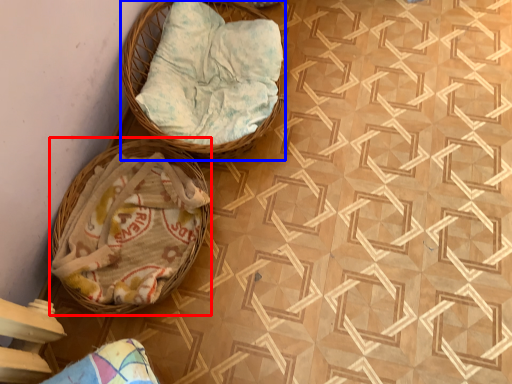
Question: Which object is further to the camera taking this photo, basket (highlighted by a red box) or basket (highlighted by a blue box)?

Choices:
 (A) basket
 (B) basket

Answer: (B)